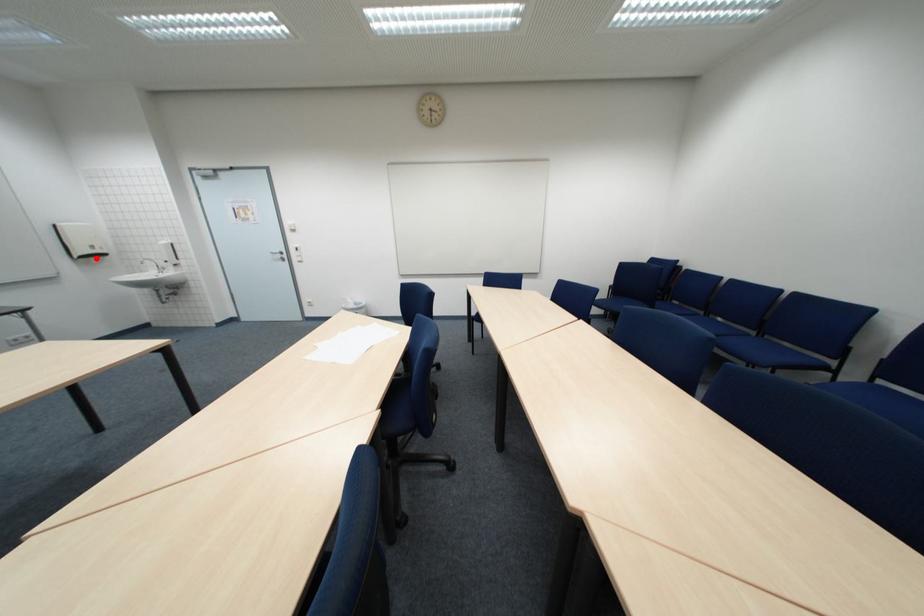
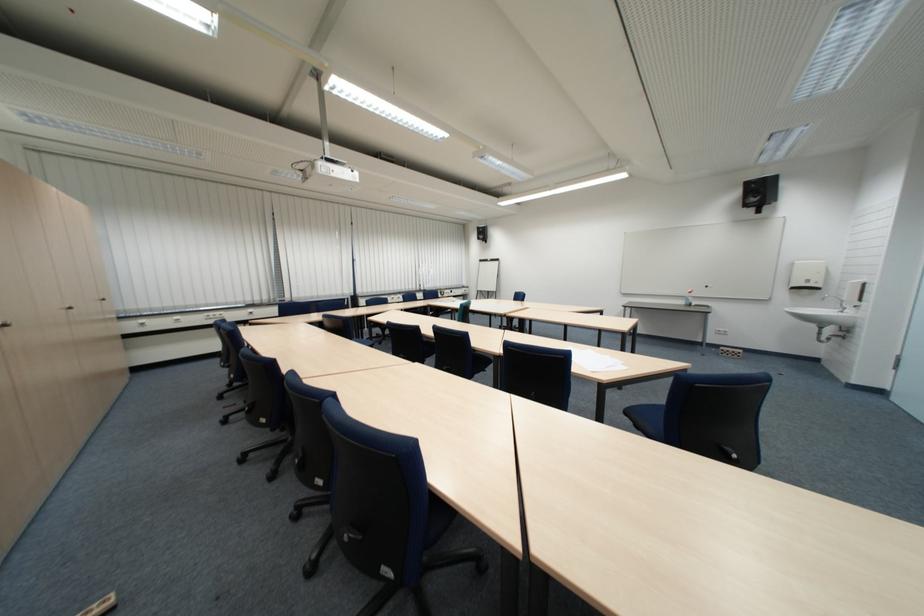
Where in the second image is the point corresponding to the highlighted location from the first image?

(807, 290)